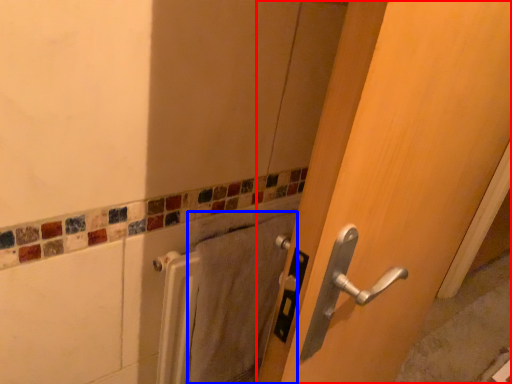
Question: Among these objects, which one is nearest to the camera, door (highlighted by a red box) or bath towel (highlighted by a blue box)?

Choices:
 (A) door
 (B) bath towel

Answer: (A)